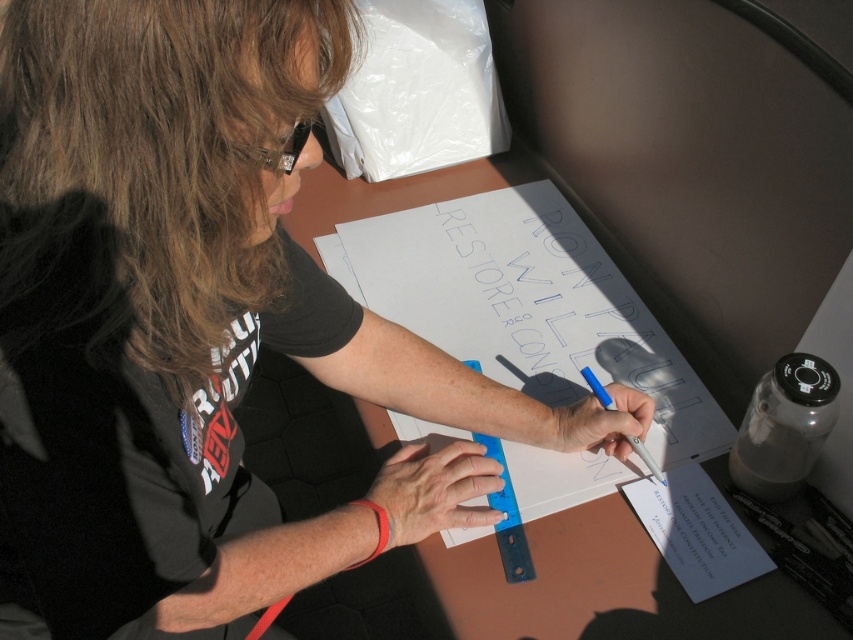
Question: Which of the following is the farthest from the observer?

Choices:
 (A) (612, 408)
 (B) (711, 540)

Answer: (A)

Question: Observing the image, what is the correct spatial positioning of brown wood table at center in reference to white paper at center?

Choices:
 (A) left
 (B) right

Answer: (A)

Question: Which is farther from the white paper at center?

Choices:
 (A) brown wood table at center
 (B) blue plastic pen at center

Answer: (A)

Question: From the image, what is the correct spatial relationship of brown wood table at center in relation to white paper at center?

Choices:
 (A) below
 (B) above

Answer: (B)

Question: Is brown wood table at center positioned before blue plastic pen at center?

Choices:
 (A) no
 (B) yes

Answer: (B)

Question: Which point appears closest to the camera in this image?

Choices:
 (A) (648, 451)
 (B) (721, 576)
 (C) (811, 614)

Answer: (C)